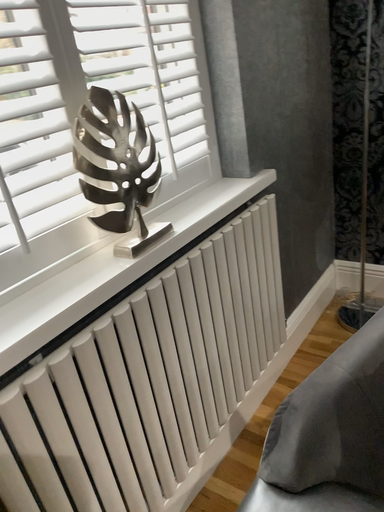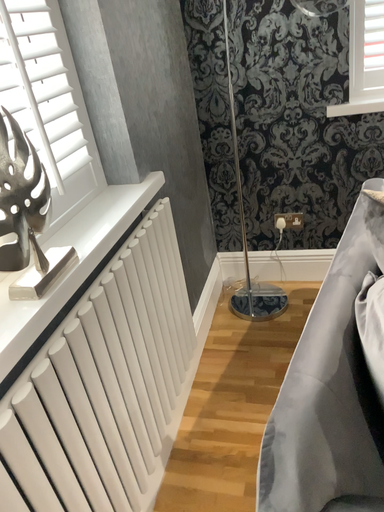
Question: How did the camera likely rotate when shooting the video?

Choices:
 (A) rotated left
 (B) rotated right

Answer: (B)